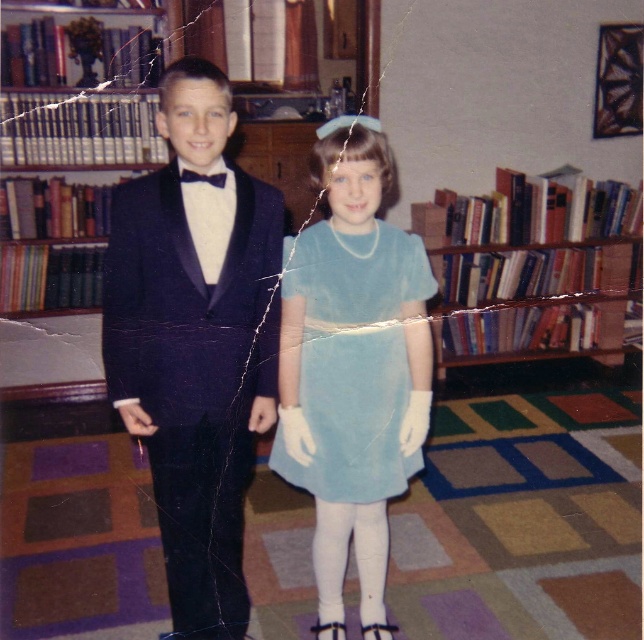
Who is taller, blue hardcover books at center or light blue satin dress at center?

Standing taller between the two is blue hardcover books at center.

Measure the distance between point (455, 264) and camera.

The distance of point (455, 264) from camera is 3.82 meters.

Which is behind, point (582, 308) or point (343, 326)?

Positioned behind is point (582, 308).

Locate an element on the screen. The image size is (644, 640). blue hardcover books at center is located at coordinates (533, 268).

Which is behind, point (102, 324) or point (153, 58)?

Point (153, 58)

Based on the photo, does shiny dark blue tuxedo at center have a greater width compared to green hardcover books at left?

In fact, shiny dark blue tuxedo at center might be narrower than green hardcover books at left.

Which is behind, point (128, 419) or point (91, 220)?

Positioned behind is point (91, 220).

Where is `shiny dark blue tuxedo at center`? shiny dark blue tuxedo at center is located at coordinates (194, 342).

Does green hardcover books at left have a larger size compared to black satin bow tie at upper center?

Yes.

Is point (14, 188) positioned after point (185, 177)?

Yes, it is behind point (185, 177).

Is point (80, 216) positioned before point (222, 177)?

No, it is behind (222, 177).

The width and height of the screenshot is (644, 640). In order to click on green hardcover books at left in this screenshot , I will do `click(68, 154)`.